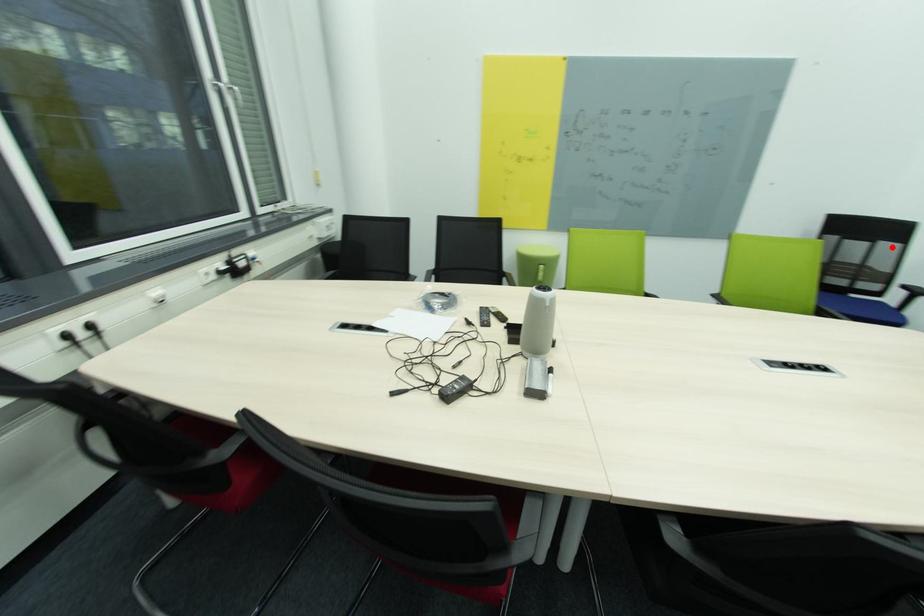
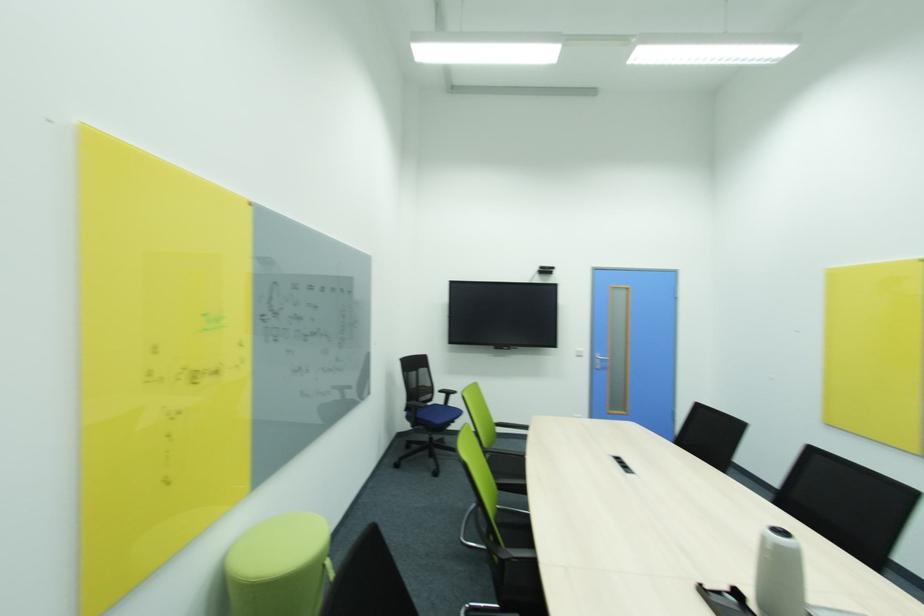
Question: I am providing you with two images of the same scene from different viewpoints. Given a red point in image1, look at the same physical point in image2. Is it:

Choices:
 (A) Closer to the viewpoint
 (B) Farther from the viewpoint

Answer: (A)